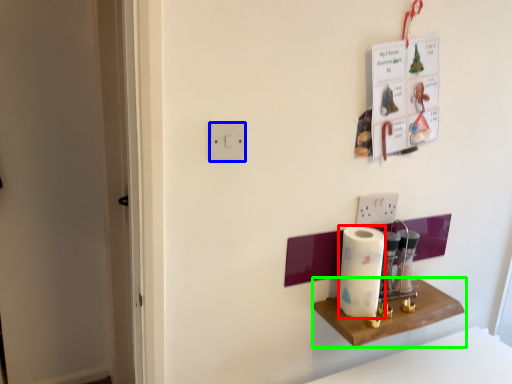
Question: Based on their relative distances, which object is nearer to paper towel (highlighted by a red box)? Choose from light switch (highlighted by a blue box) and shelf (highlighted by a green box).

Choices:
 (A) light switch
 (B) shelf

Answer: (B)